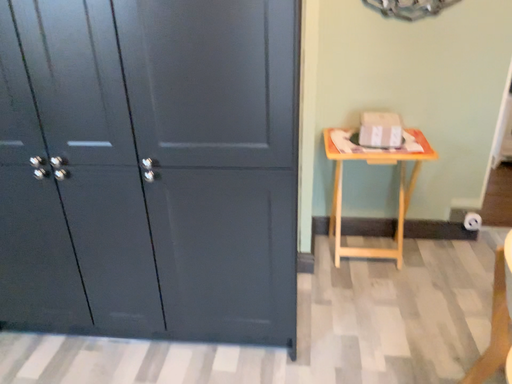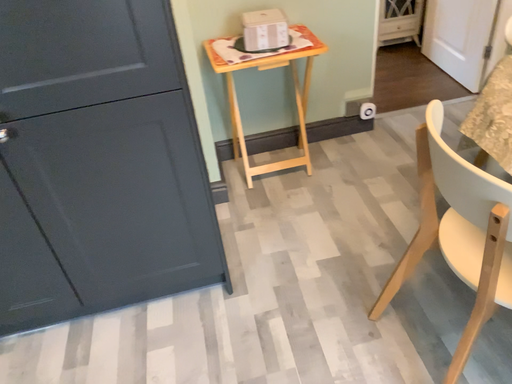
Question: How did the camera likely rotate when shooting the video?

Choices:
 (A) rotated upward
 (B) rotated downward

Answer: (B)